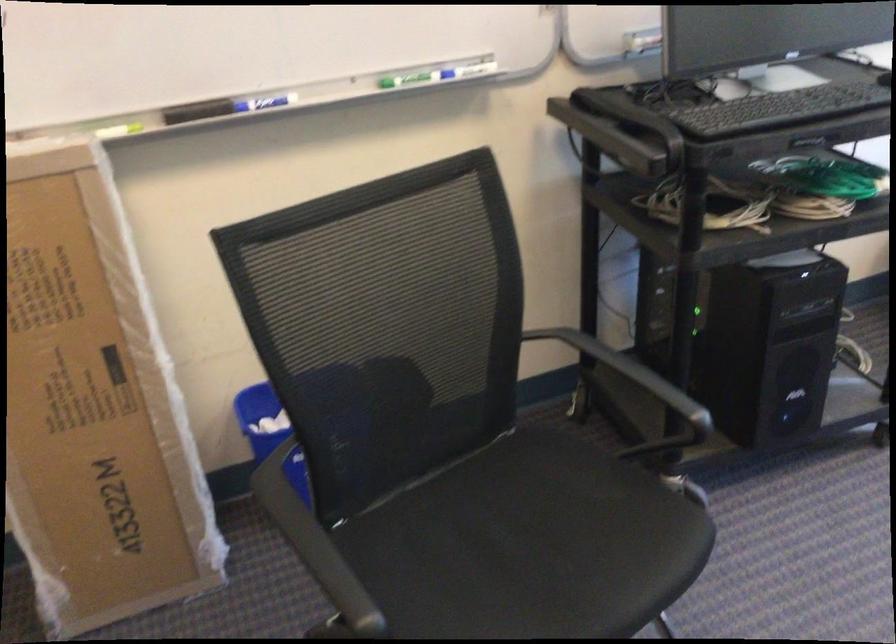
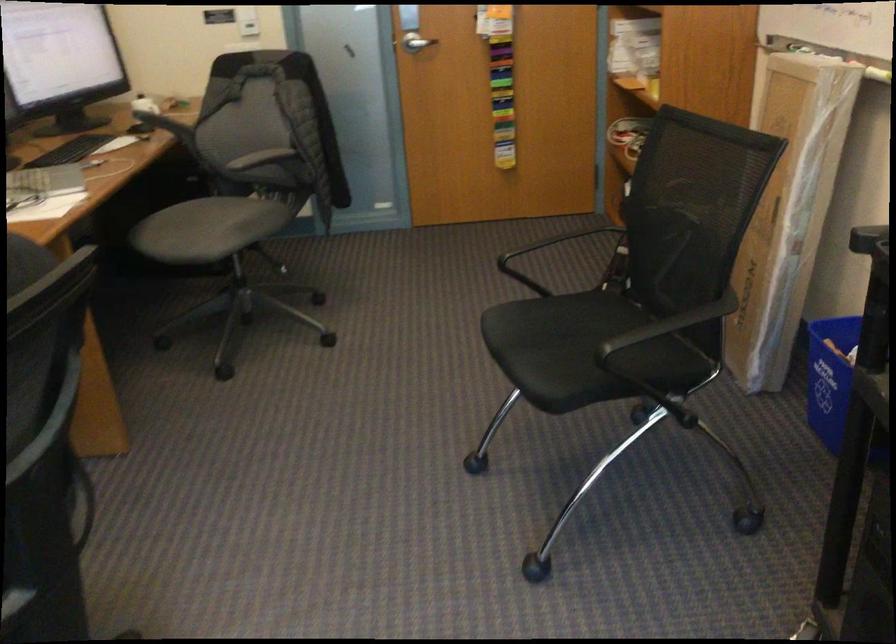
In the second image, find the point that corresponds to the point at 99,352 in the first image.

(788, 212)